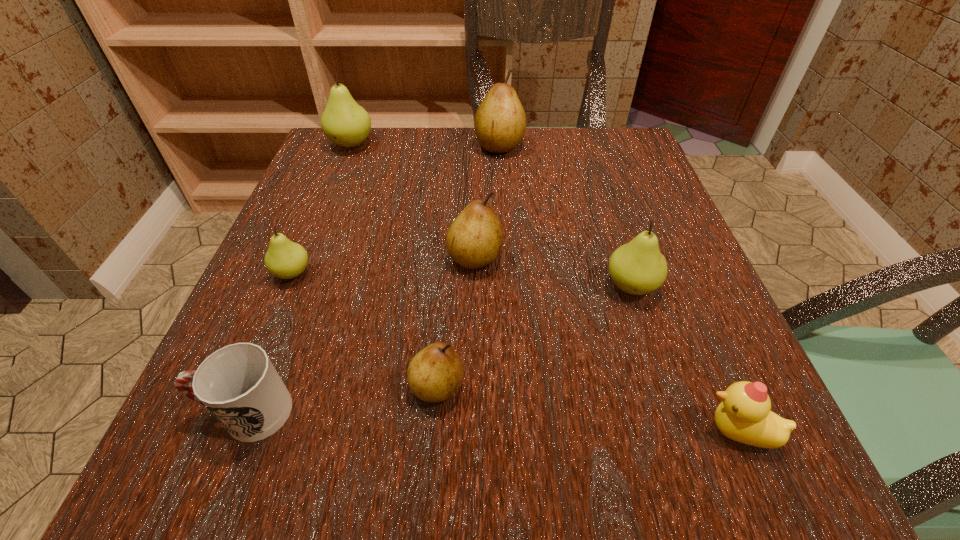
Where is `the farthest brown pear`? The image size is (960, 540). the farthest brown pear is located at coordinates (500, 121).

Where is `the biggest green pear`? This screenshot has height=540, width=960. the biggest green pear is located at coordinates (345, 123).

At what (x,y) coordinates should I click in order to perform the action: click on the second farthest brown pear. Please return your answer as a coordinate pair (x, y). The image size is (960, 540). Looking at the image, I should click on (475, 238).

Find the location of `the rightmost green pear`. the rightmost green pear is located at coordinates (637, 268).

You are a GUI agent. You are given a task and a screenshot of the screen. Output one action in this format:
    pyautogui.click(x=<x>, y=<y>)
    Task: Click on the second biggest green pear
    The image size is (960, 540).
    Given the screenshot: What is the action you would take?
    pyautogui.click(x=637, y=268)

Find the location of a particular element. Image resolution: width=960 pixels, height=540 pixels. the smallest green pear is located at coordinates (285, 259).

Find the location of a particular element. The image size is (960, 540). the nearest pear is located at coordinates (435, 373).

This screenshot has width=960, height=540. What are the coordinates of `the smallest brown pear` in the screenshot? It's located at (435, 373).

The image size is (960, 540). I want to click on duckling, so click(744, 415).

The height and width of the screenshot is (540, 960). Find the location of `cup`. cup is located at coordinates (238, 384).